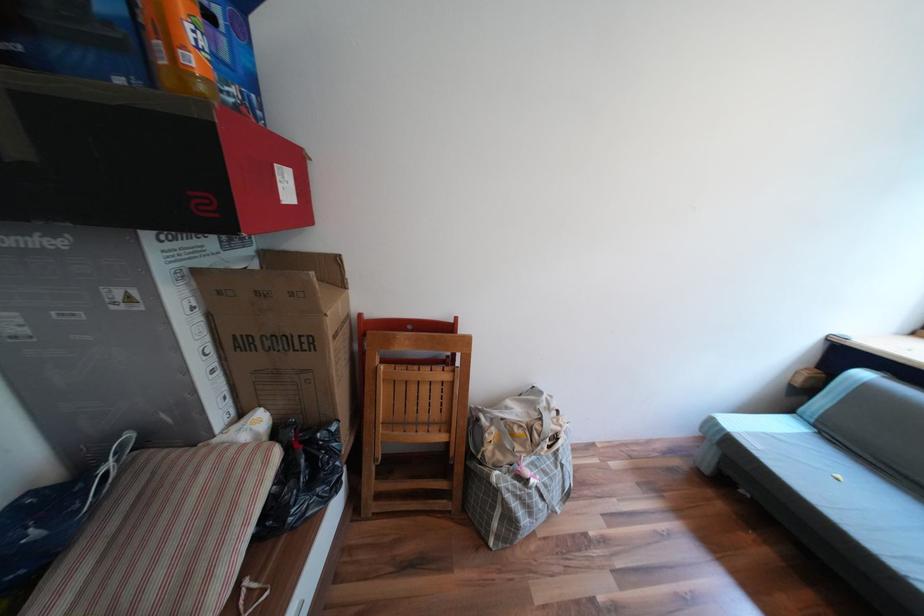
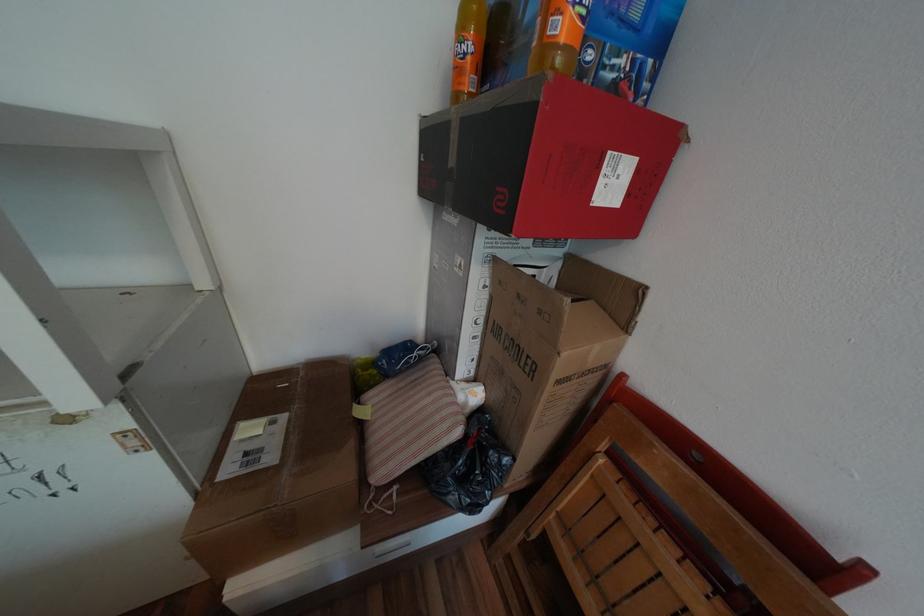
Where in the second image is the point corresponding to point 289,185 from the first image?

(611, 182)